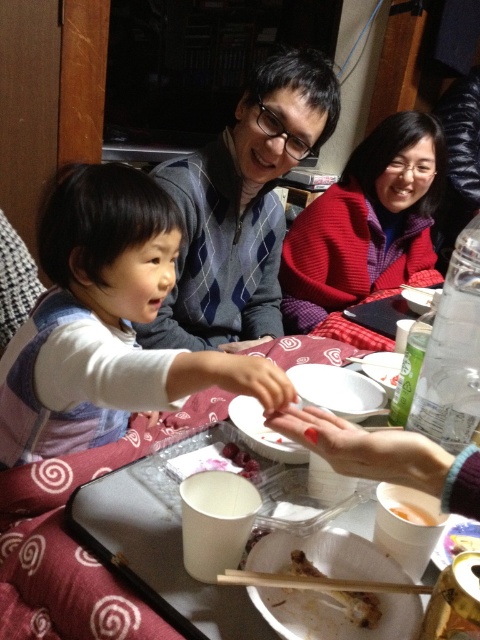
You are helping to organize a family dinner and need to place the red fleece sweater at upper right and the white paper tray at lower center on a shelf. If the shelf has limited space, which item should you place first to ensure both fit?

The white paper tray at lower center should be placed first since it is smaller than the red fleece sweater at upper right, allowing enough space for both items on the shelf.

You are a guest at this family gathering and need to place a small gift on the table without covering any existing items. Considering the positions of the matte blue vest at lower left and the shiny red cherries at center, which object should you avoid placing the gift near to ensure it doesn

You should avoid placing the gift near the matte blue vest at lower left because it has a greater height than the shiny red cherries at center, which means it might cast a shadow or block the view of the gift more effectively.